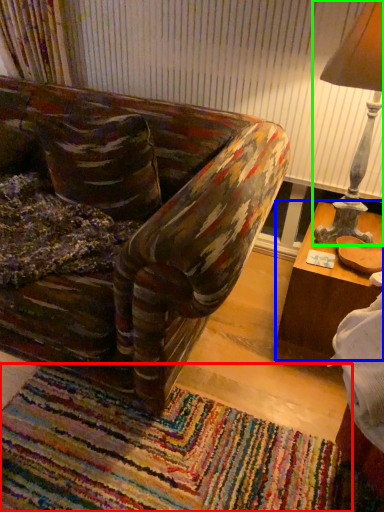
Question: Which is nearer to the mat (highlighted by a red box)? table (highlighted by a blue box) or table lamp (highlighted by a green box).

Choices:
 (A) table
 (B) table lamp

Answer: (A)